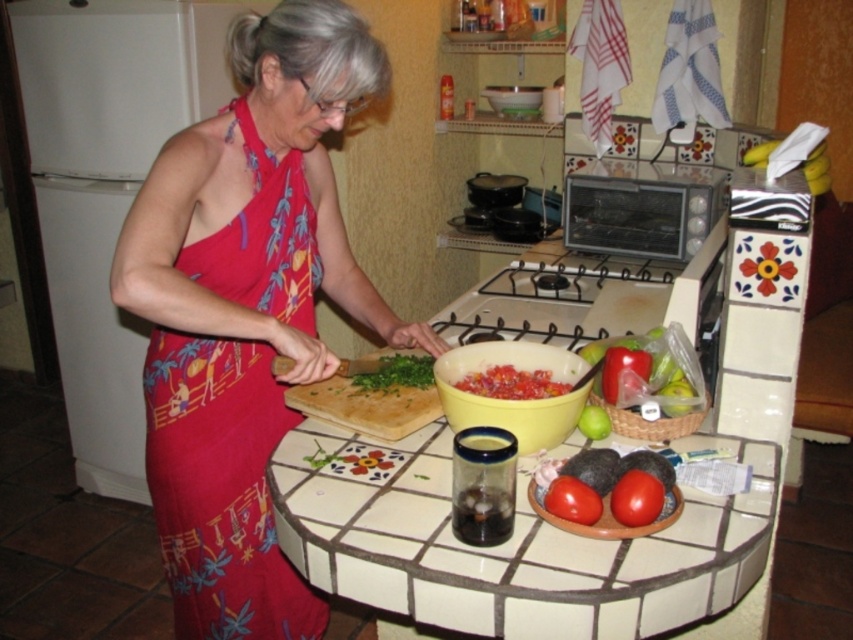
Is tomato paste bowl at center further to the viewer compared to green leafy vegetable at center?

That is False.

Does tomato paste bowl at center have a greater height compared to green leafy vegetable at center?

No, tomato paste bowl at center is not taller than green leafy vegetable at center.

Is point (521, 400) positioned after point (384, 358)?

No, it is not.

I want to click on tomato paste bowl at center, so click(512, 384).

Which is behind, point (381, 384) or point (581, 426)?

The point (381, 384) is more distant.

How far apart are green leafy vegetable at center and green matte apple at center?

green leafy vegetable at center and green matte apple at center are 13.60 inches apart.

Where is `green leafy vegetable at center`? green leafy vegetable at center is located at coordinates (398, 372).

Does smooth red tomato at lower right have a greater width compared to green matte apple at center?

Yes.

Can you confirm if smooth red tomato at lower right is positioned above green matte apple at center?

No.

I want to click on smooth red tomato at lower right, so click(x=636, y=499).